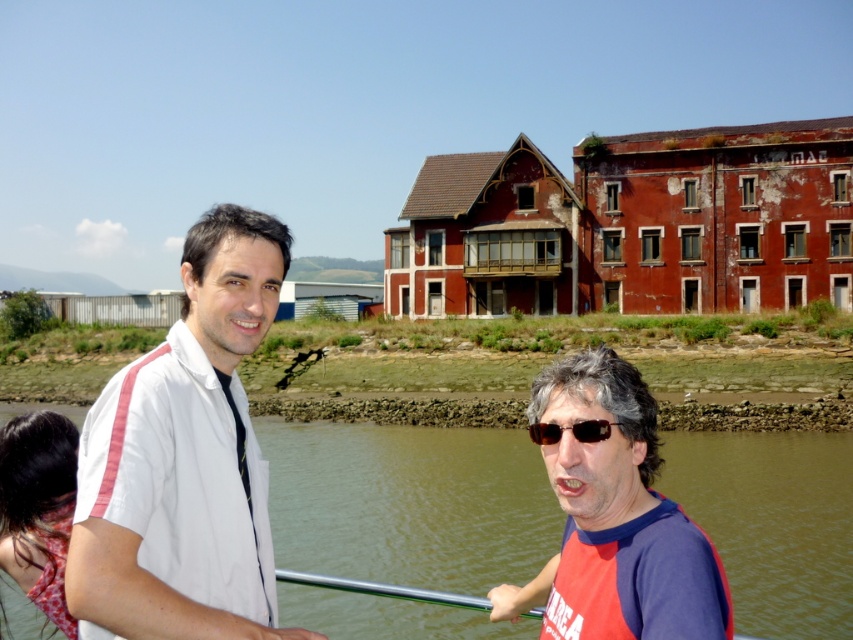
Question: From the image, what is the correct spatial relationship of white fabric shirt at left in relation to black plastic sunglasses at lower center?

Choices:
 (A) right
 (B) left

Answer: (B)

Question: Which point is closer to the camera?

Choices:
 (A) (538, 477)
 (B) (604, 429)
 (C) (16, 481)

Answer: (B)

Question: Which object is the closest to the matte red scarf at lower left?

Choices:
 (A) red fabric shirt at center
 (B) brown water at lower center
 (C) black plastic sunglasses at lower center
 (D) white fabric shirt at left

Answer: (D)

Question: Is brown water at lower center wider than red fabric shirt at center?

Choices:
 (A) no
 (B) yes

Answer: (B)

Question: Is brown water at lower center wider than white fabric shirt at left?

Choices:
 (A) yes
 (B) no

Answer: (A)

Question: Which point is farther to the camera?

Choices:
 (A) (20, 580)
 (B) (323, 509)
 (C) (583, 419)
 (D) (546, 438)

Answer: (B)